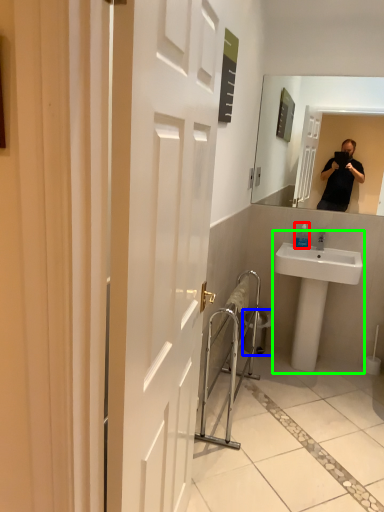
Question: Which object is positioned closest to bottle (highlighted by a red box)? Select from trash bin/can (highlighted by a blue box) and sink (highlighted by a green box).

Choices:
 (A) trash bin/can
 (B) sink

Answer: (B)